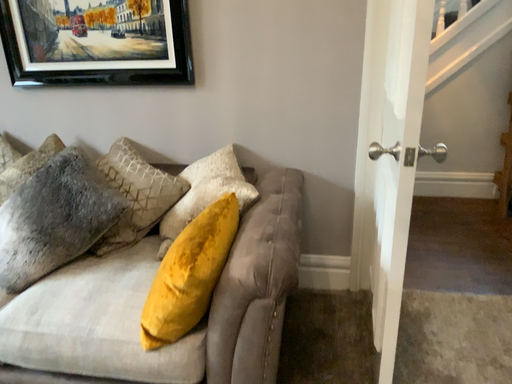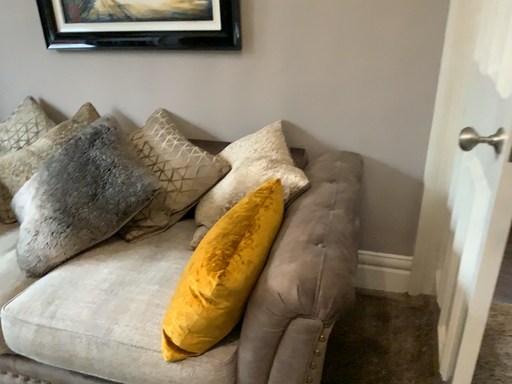
Question: How did the camera likely rotate when shooting the video?

Choices:
 (A) rotated right
 (B) rotated left

Answer: (B)